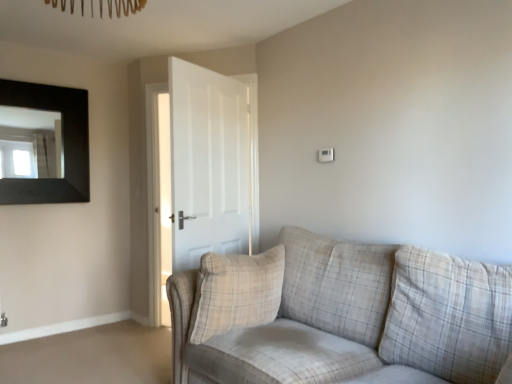
Locate an element on the screen. The height and width of the screenshot is (384, 512). plaid fabric couch at center is located at coordinates (340, 315).

What do you see at coordinates (141, 175) in the screenshot? I see `white matte door at center` at bounding box center [141, 175].

This screenshot has height=384, width=512. I want to click on plaid fabric couch at center, so click(340, 315).

Between white matte door at center and plaid fabric couch at center, which one has more height?

white matte door at center.

Can plaid fabric couch at center be found inside white matte door at center?

No, plaid fabric couch at center is not a part of white matte door at center.

Is point (140, 219) closer or farther from the camera than point (343, 285)?

Clearly, point (140, 219) is more distant from the camera than point (343, 285).

Are white matte door at center and plaid fabric couch at center making contact?

white matte door at center and plaid fabric couch at center are not in contact.

Is point (200, 331) closer to viewer compared to point (306, 231)?

Yes, point (200, 331) is closer to viewer.

From a real-world perspective, is beige plaid pillow at center located higher than plaid fabric couch at center?

Yes, from a real-world perspective, beige plaid pillow at center is above plaid fabric couch at center.

Between beige plaid pillow at center and plaid fabric couch at center, which one is positioned in front?

plaid fabric couch at center is closer to the camera.

Would you say beige plaid pillow at center is to the left or to the right of plaid fabric couch at center in the picture?

In the image, beige plaid pillow at center appears on the left side of plaid fabric couch at center.

Is black matte picture frame at upper left not near beige plaid pillow at center?

Absolutely, black matte picture frame at upper left is distant from beige plaid pillow at center.

Is black matte picture frame at upper left not within beige plaid pillow at center?

Yes, black matte picture frame at upper left is not within beige plaid pillow at center.

Based on the photo, considering the sizes of black matte picture frame at upper left and beige plaid pillow at center in the image, is black matte picture frame at upper left taller or shorter than beige plaid pillow at center?

Clearly, black matte picture frame at upper left is taller compared to beige plaid pillow at center.

What's the angular difference between black matte picture frame at upper left and plaid fabric couch at center's facing directions?

The angle between the facing direction of black matte picture frame at upper left and the facing direction of plaid fabric couch at center is 90.8 degrees.

In terms of size, does black matte picture frame at upper left appear bigger or smaller than plaid fabric couch at center?

Clearly, black matte picture frame at upper left is smaller in size than plaid fabric couch at center.

Relative to plaid fabric couch at center, is black matte picture frame at upper left in front or behind?

black matte picture frame at upper left is behind plaid fabric couch at center.

From the image's perspective, which one is positioned higher, black matte picture frame at upper left or plaid fabric couch at center?

black matte picture frame at upper left.

Based on the photo, is plaid fabric couch at center taller than beige plaid pillow at center?

Correct, plaid fabric couch at center is much taller as beige plaid pillow at center.

Considering the sizes of plaid fabric couch at center and beige plaid pillow at center in the image, is plaid fabric couch at center wider or thinner than beige plaid pillow at center?

In the image, plaid fabric couch at center appears to be wider than beige plaid pillow at center.

Is plaid fabric couch at center far away from beige plaid pillow at center?

plaid fabric couch at center is actually quite close to beige plaid pillow at center.

Considering the positions of points (333, 281) and (221, 308), is point (333, 281) closer to camera compared to point (221, 308)?

No, it is behind (221, 308).

Where is `door below the black matte picture frame at upper left (from the image's perspective)`? door below the black matte picture frame at upper left (from the image's perspective) is located at coordinates (141, 175).

From a real-world perspective, is white matte door at center above or below black matte picture frame at upper left?

From a real-world perspective, white matte door at center is physically below black matte picture frame at upper left.

Can you confirm if white matte door at center is positioned to the right of black matte picture frame at upper left?

Yes, white matte door at center is to the right of black matte picture frame at upper left.

Considering the sizes of objects white matte door at center and beige plaid pillow at center in the image provided, who is wider, white matte door at center or beige plaid pillow at center?

beige plaid pillow at center.

Which point is more forward, (137, 230) or (246, 294)?

The point (246, 294) is more forward.

Considering the relative positions of white matte door at center and beige plaid pillow at center in the image provided, is white matte door at center to the left of beige plaid pillow at center from the viewer's perspective?

Indeed, white matte door at center is positioned on the left side of beige plaid pillow at center.

From the image's perspective, which is above, white matte door at center or beige plaid pillow at center?

white matte door at center.

At what (x,y) coordinates should I click in order to perform the action: click on door behind the plaid fabric couch at center. Please return your answer as a coordinate pair (x, y). Looking at the image, I should click on (141, 175).

The height and width of the screenshot is (384, 512). What are the coordinates of `studio couch below the beige plaid pillow at center (from a real-world perspective)` in the screenshot? It's located at (340, 315).

Estimate the real-world distances between objects in this image. Which object is closer to black matte picture frame at upper left, white matte door at center or beige plaid pillow at center?

white matte door at center lies closer to black matte picture frame at upper left than the other object.

When comparing their distances from beige plaid pillow at center, does black matte picture frame at upper left or white matte door at center seem closer?

white matte door at center is positioned closer to the anchor beige plaid pillow at center.

Estimate the real-world distances between objects in this image. Which object is closer to white matte door at center, black matte picture frame at upper left or plaid fabric couch at center?

black matte picture frame at upper left is closer to white matte door at center.

When comparing their distances from black matte picture frame at upper left, does beige plaid pillow at center or plaid fabric couch at center seem further?

Based on the image, plaid fabric couch at center appears to be further to black matte picture frame at upper left.

Which object lies nearer to the anchor point plaid fabric couch at center, black matte picture frame at upper left or white matte door at center?

white matte door at center lies closer to plaid fabric couch at center than the other object.

When comparing their distances from black matte picture frame at upper left, does beige plaid pillow at center or white matte door at center seem closer?

white matte door at center is positioned closer to the anchor black matte picture frame at upper left.

Looking at the image, which one is located closer to beige plaid pillow at center, plaid fabric couch at center or black matte picture frame at upper left?

Based on the image, plaid fabric couch at center appears to be nearer to beige plaid pillow at center.

Considering their positions, is beige plaid pillow at center positioned further to white matte door at center than plaid fabric couch at center?

Among the two, plaid fabric couch at center is located further to white matte door at center.

Image resolution: width=512 pixels, height=384 pixels. Identify the location of pillow positioned between plaid fabric couch at center and black matte picture frame at upper left from near to far. (236, 292).

You are a GUI agent. You are given a task and a screenshot of the screen. Output one action in this format:
    pyautogui.click(x=<x>, y=<y>)
    Task: Click on the door positioned between plaid fabric couch at center and black matte picture frame at upper left from near to far
    
    Given the screenshot: What is the action you would take?
    pyautogui.click(x=141, y=175)

Find the location of a particular element. This screenshot has height=384, width=512. door situated between black matte picture frame at upper left and beige plaid pillow at center from left to right is located at coordinates (141, 175).

The image size is (512, 384). Identify the location of pillow between plaid fabric couch at center and white matte door at center from front to back. (236, 292).